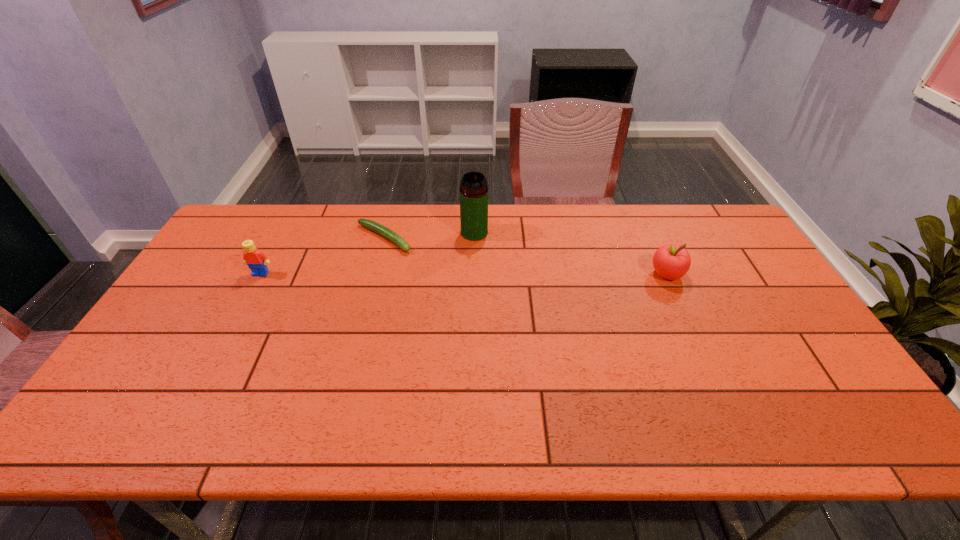
Find the location of `free space on the desktop that is between the leftmost object and the apple and is positioned from the spout of the tallest object`. free space on the desktop that is between the leftmost object and the apple and is positioned from the spout of the tallest object is located at coordinates (497, 274).

You are a GUI agent. You are given a task and a screenshot of the screen. Output one action in this format:
    pyautogui.click(x=<x>, y=<y>)
    Task: Click on the vacant space on the desktop that is between the Lego and the rightmost object and is positioned on the front-facing side of the zucchini
    
    Given the screenshot: What is the action you would take?
    pyautogui.click(x=442, y=274)